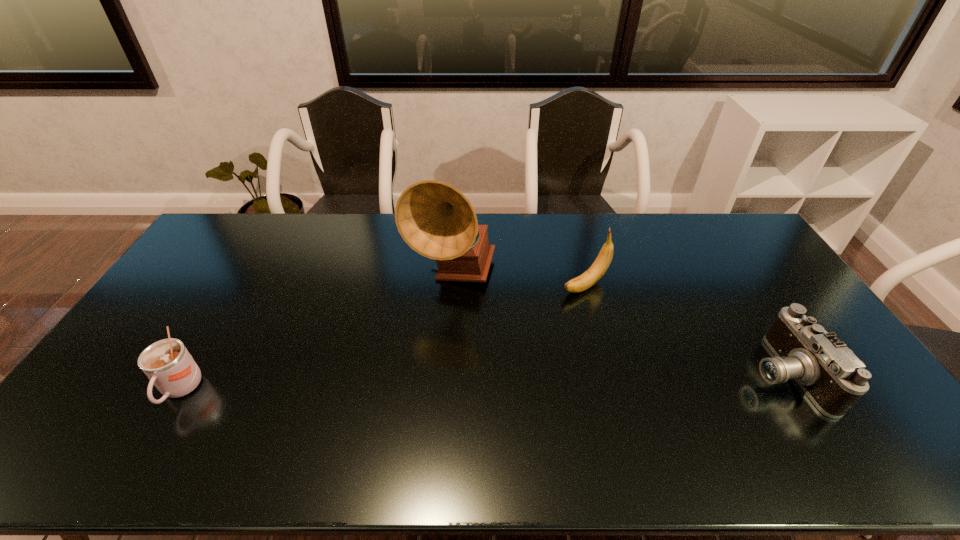
Find the location of a particular element. This screenshot has height=540, width=960. blank area located 0.200m at the start of the peel on the banana is located at coordinates (520, 321).

Locate an element on the screen. vacant space situated 0.260m at the start of the peel on the banana is located at coordinates (506, 330).

This screenshot has height=540, width=960. Identify the location of vacant space located 0.240m on the horn of the phonograph record. (487, 364).

Where is `vacant region located 0.310m on the horn of the phonograph record`? vacant region located 0.310m on the horn of the phonograph record is located at coordinates (494, 385).

Image resolution: width=960 pixels, height=540 pixels. Identify the location of free space located 0.130m on the horn of the phonograph record. (475, 336).

The height and width of the screenshot is (540, 960). Find the location of `object that is at the far edge`. object that is at the far edge is located at coordinates (436, 220).

At what (x,y) coordinates should I click in order to perform the action: click on cup present at the near edge. Please return your answer as a coordinate pair (x, y). Looking at the image, I should click on (167, 363).

I want to click on camera that is at the near edge, so click(x=830, y=374).

Identify the location of object located at the right edge. (830, 374).

Where is `object at the near right corner`? The height and width of the screenshot is (540, 960). object at the near right corner is located at coordinates (830, 374).